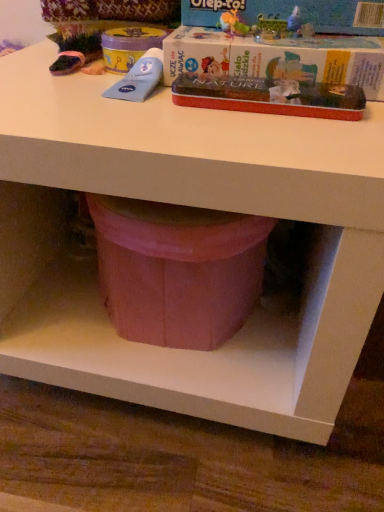
Identify the location of free point in front of metallic red tin at upper center, the third paperback book positioned from the top. (271, 141).